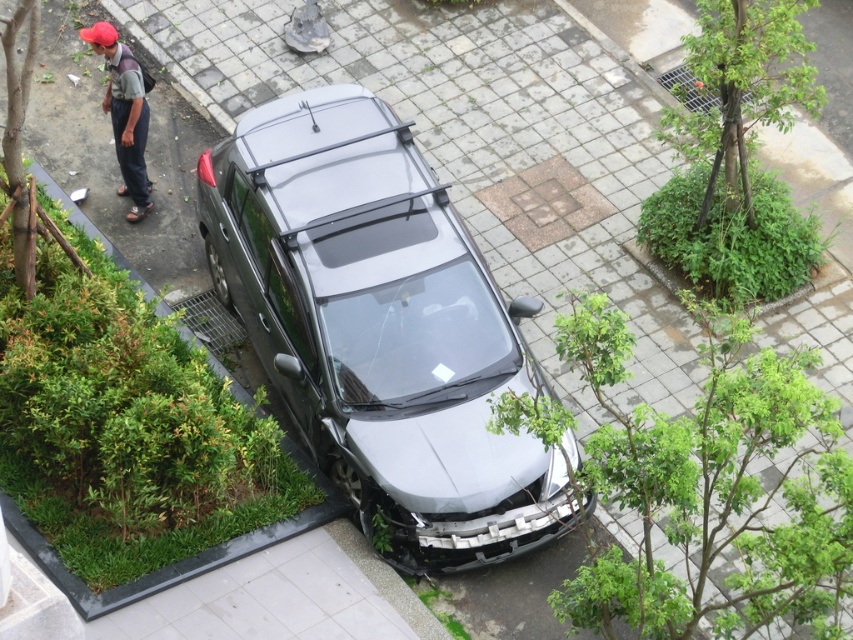
Question: Does satin black car at center have a lesser width compared to matte red cap at upper left?

Choices:
 (A) no
 (B) yes

Answer: (A)

Question: Is satin black car at center further to the viewer compared to matte red cap at upper left?

Choices:
 (A) yes
 (B) no

Answer: (B)

Question: Which of the following is the farthest from the observer?

Choices:
 (A) (126, 177)
 (B) (279, 260)

Answer: (A)

Question: Which of the following is the farthest from the observer?

Choices:
 (A) pos(404,232)
 (B) pos(112,61)

Answer: (B)

Question: Which of the following is the closest to the observer?

Choices:
 (A) satin black car at center
 (B) matte red cap at upper left

Answer: (A)

Question: Is satin black car at center below matte red cap at upper left?

Choices:
 (A) yes
 (B) no

Answer: (A)